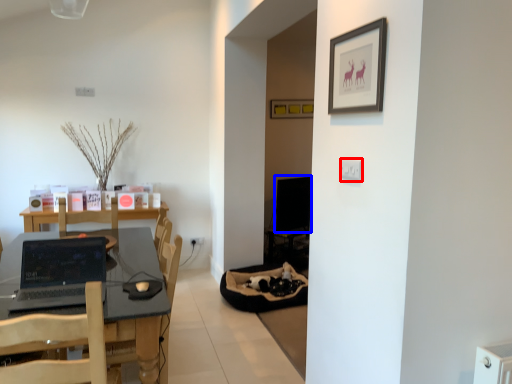
Question: Which of the following is the farthest to the observer, electric outlet (highlighted by a red box) or computer monitor (highlighted by a blue box)?

Choices:
 (A) electric outlet
 (B) computer monitor

Answer: (B)